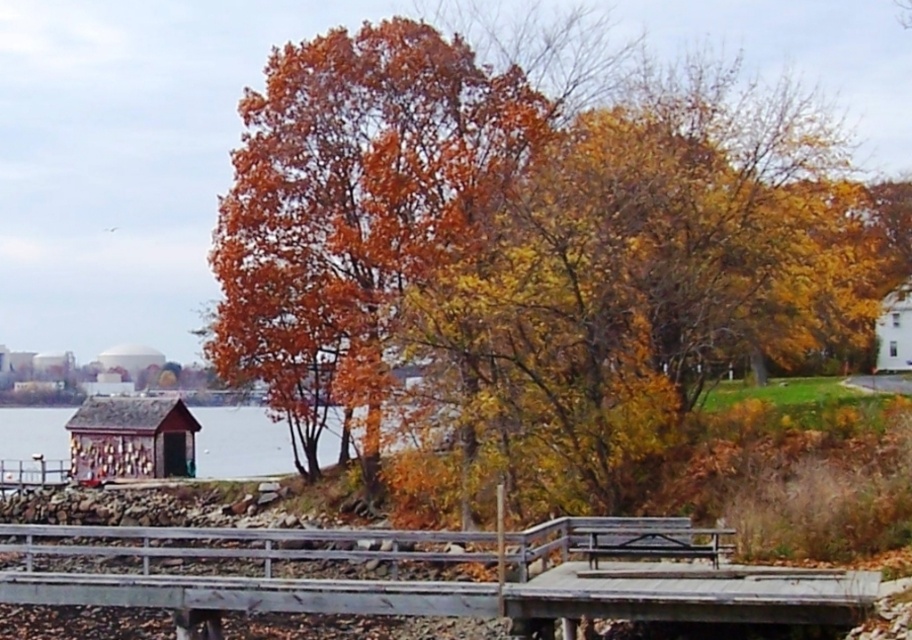
Question: Where is orange matte tree at center located in relation to gray wooden bridge at lower center in the image?

Choices:
 (A) right
 (B) left

Answer: (A)

Question: Is gray wooden bridge at lower center positioned at the back of smooth wooden dock at lower left?

Choices:
 (A) yes
 (B) no

Answer: (B)

Question: Which point is closer to the camera?

Choices:
 (A) orange matte tree at center
 (B) gray wooden bridge at lower center
 (C) smooth wooden dock at lower left

Answer: (B)

Question: Can you confirm if orange matte tree at center is positioned to the right of gray wooden bridge at lower center?

Choices:
 (A) yes
 (B) no

Answer: (A)

Question: Among these points, which one is nearest to the camera?

Choices:
 (A) click(x=607, y=554)
 (B) click(x=223, y=419)
 (C) click(x=268, y=209)

Answer: (A)

Question: Which object is closer to the camera taking this photo?

Choices:
 (A) smooth wooden dock at lower left
 (B) orange matte tree at center

Answer: (B)